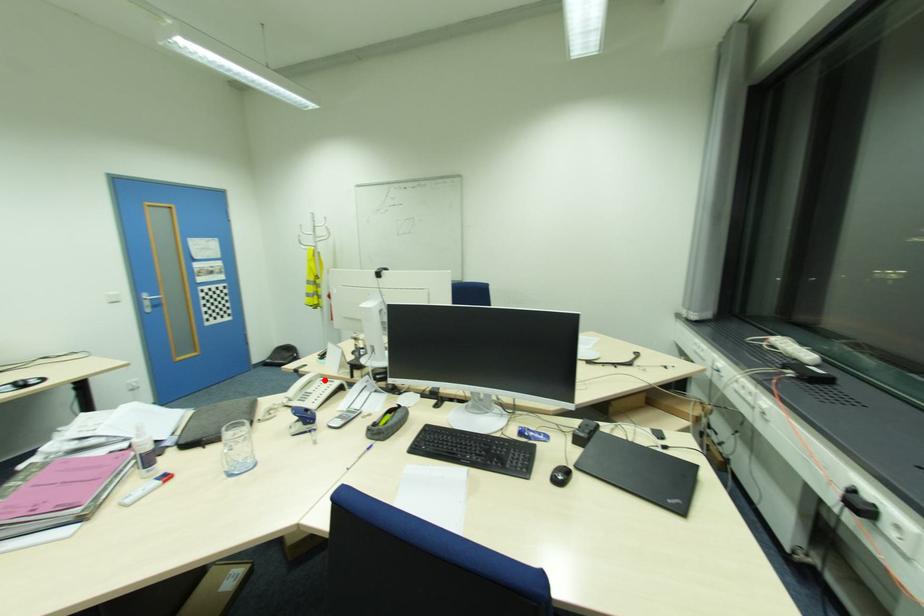
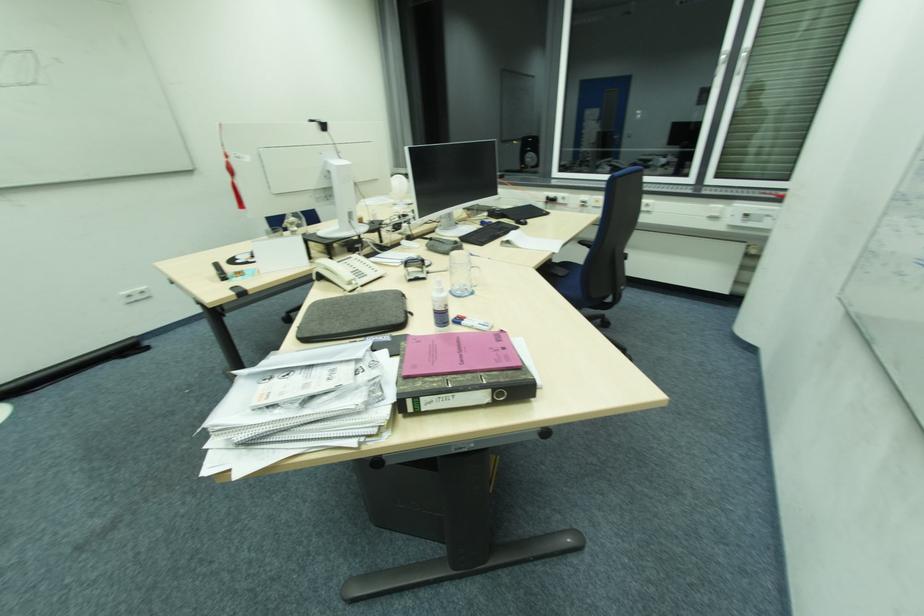
Where in the second image is the point corresponding to the highlighted location from the first image?

(342, 262)